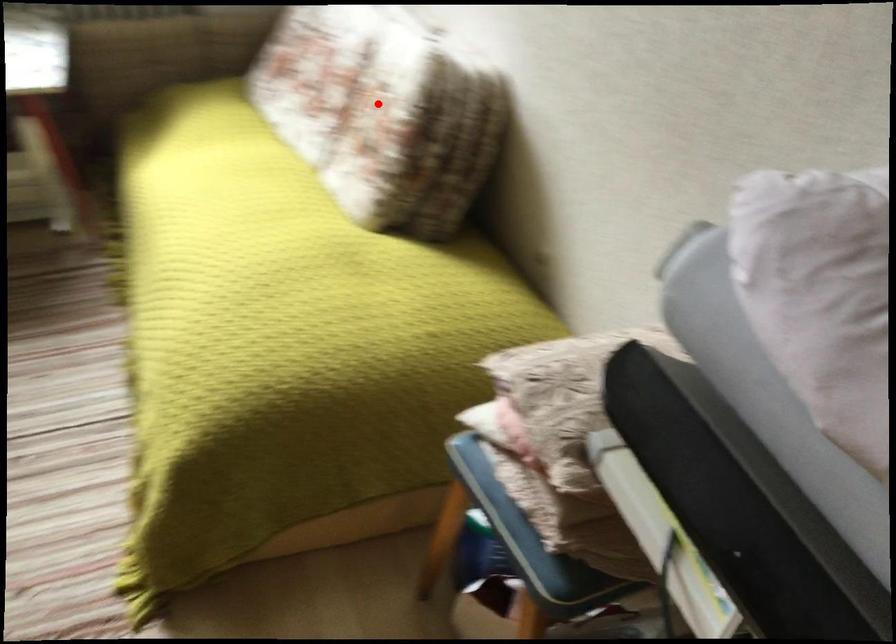
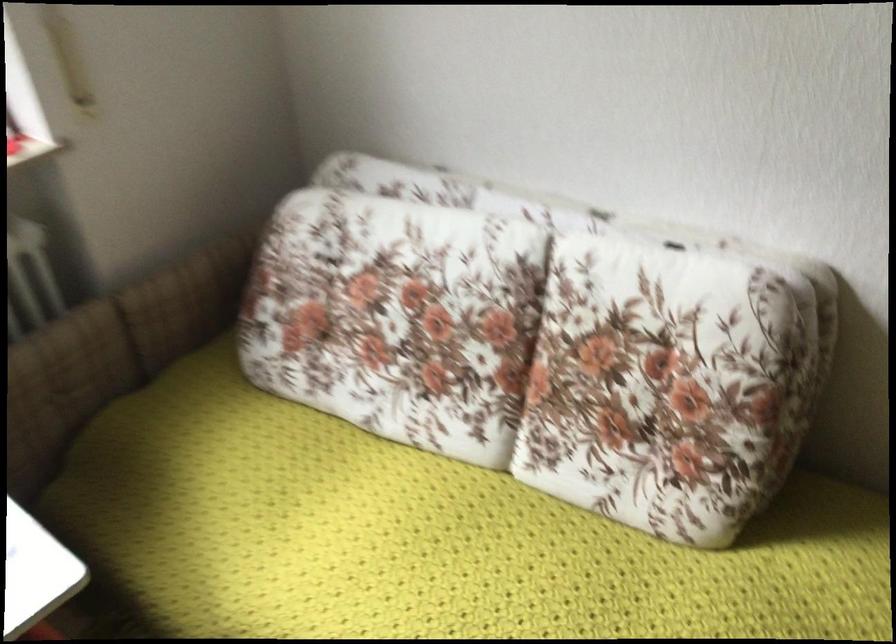
Question: I am providing you with two images of the same scene from different viewpoints. A red point is shown in image1. For the corresponding object point in image2, is it positioned nearer or farther from the camera?

Choices:
 (A) Nearer
 (B) Farther

Answer: (A)